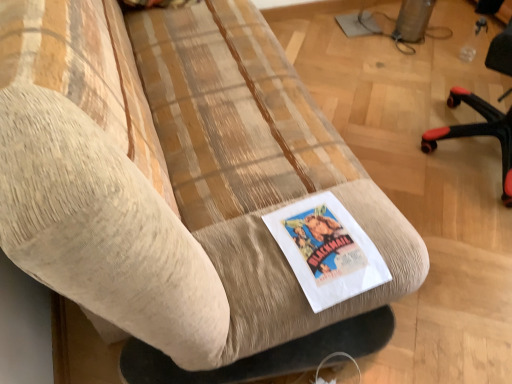
Question: Is black plastic chair at right outside white paper flyer at center?

Choices:
 (A) no
 (B) yes

Answer: (B)

Question: Does black plastic chair at right have a lesser height compared to white paper flyer at center?

Choices:
 (A) no
 (B) yes

Answer: (A)

Question: Is the position of black plastic chair at right more distant than that of white paper flyer at center?

Choices:
 (A) no
 (B) yes

Answer: (B)

Question: Considering the relative sizes of black plastic chair at right and white paper flyer at center in the image provided, is black plastic chair at right taller than white paper flyer at center?

Choices:
 (A) yes
 (B) no

Answer: (A)

Question: Considering the relative sizes of black plastic chair at right and white paper flyer at center in the image provided, is black plastic chair at right bigger than white paper flyer at center?

Choices:
 (A) no
 (B) yes

Answer: (B)

Question: From the image's perspective, does black plastic chair at right appear lower than white paper flyer at center?

Choices:
 (A) yes
 (B) no

Answer: (B)

Question: Can you confirm if white paper flyer at center is positioned to the right of black plastic chair at right?

Choices:
 (A) no
 (B) yes

Answer: (A)

Question: Is white paper flyer at center closer to camera compared to black plastic chair at right?

Choices:
 (A) yes
 (B) no

Answer: (A)

Question: Considering the relative sizes of white paper flyer at center and black plastic chair at right in the image provided, is white paper flyer at center taller than black plastic chair at right?

Choices:
 (A) no
 (B) yes

Answer: (A)

Question: Is white paper flyer at center looking in the opposite direction of black plastic chair at right?

Choices:
 (A) yes
 (B) no

Answer: (B)

Question: Is white paper flyer at center with black plastic chair at right?

Choices:
 (A) yes
 (B) no

Answer: (B)

Question: Does white paper flyer at center come behind black plastic chair at right?

Choices:
 (A) no
 (B) yes

Answer: (A)

Question: Is black plastic chair at right in front of or behind white paper flyer at center in the image?

Choices:
 (A) behind
 (B) front

Answer: (A)